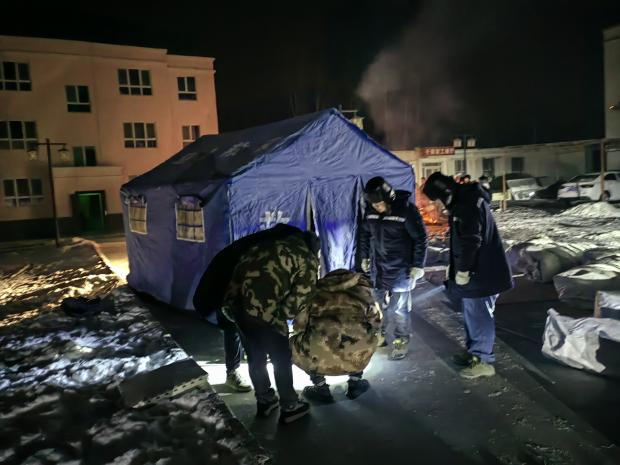
This screenshot has height=465, width=620. Identify the location of lamp light. (63, 157), (30, 156).